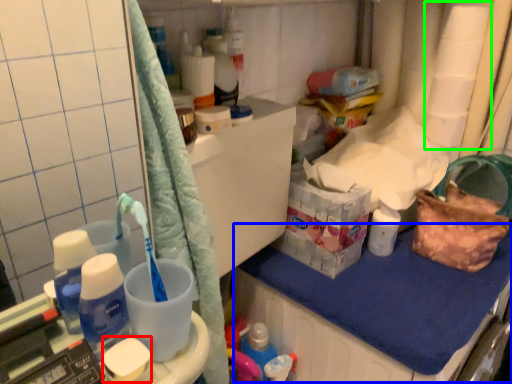
Question: Which is farther away from soap (highlighted by a red box)? counter top (highlighted by a blue box) or toilet paper (highlighted by a green box)?

Choices:
 (A) counter top
 (B) toilet paper

Answer: (B)